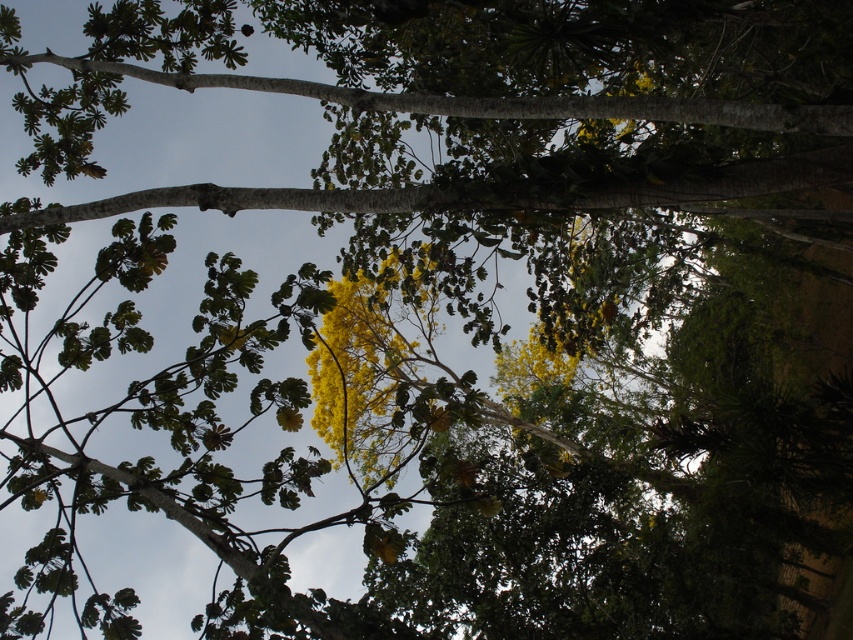
Looking at this image, you are a bird perched on a branch in the tropical forest. You want to fly up to the sky but need to decide which branch to take off from. If you choose the green leafy branch at upper center or the smooth bark branch at upper center, which one is closer to the sky?

The smooth bark branch at upper center is closer to the sky because the green leafy branch at upper center is below it.

You are a bird flying through the tropical forest. You see a green leafy branch at upper center and a smooth bark branch at upper center. Which branch would provide a larger perch for you to land on?

The green leafy branch at upper center is bigger than the smooth bark branch at upper center, so it would provide a larger perch for you to land on.

Looking at this image, you are an ornithologist observing this tropical forest scene. You notice two branches at the upper center of the image. Which one is positioned to the left when looking at the green leafy branch at upper center and the smooth bark branch at upper center?

The green leafy branch at upper center is positioned to the left of the smooth bark branch at upper center.